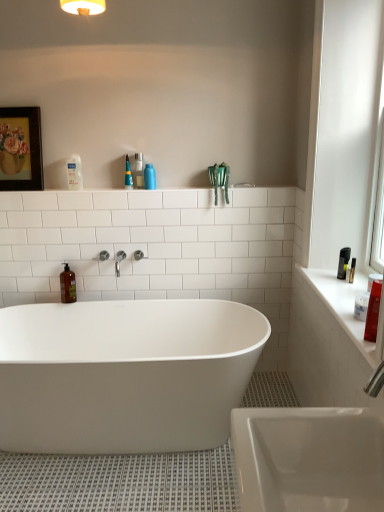
The width and height of the screenshot is (384, 512). I want to click on vacant space in between translucent plastic spray bottle at upper center, the fourth cleaning product positioned from the bottom, and clear plastic bottle at upper left, which is the second toiletry from right to left, so click(x=112, y=187).